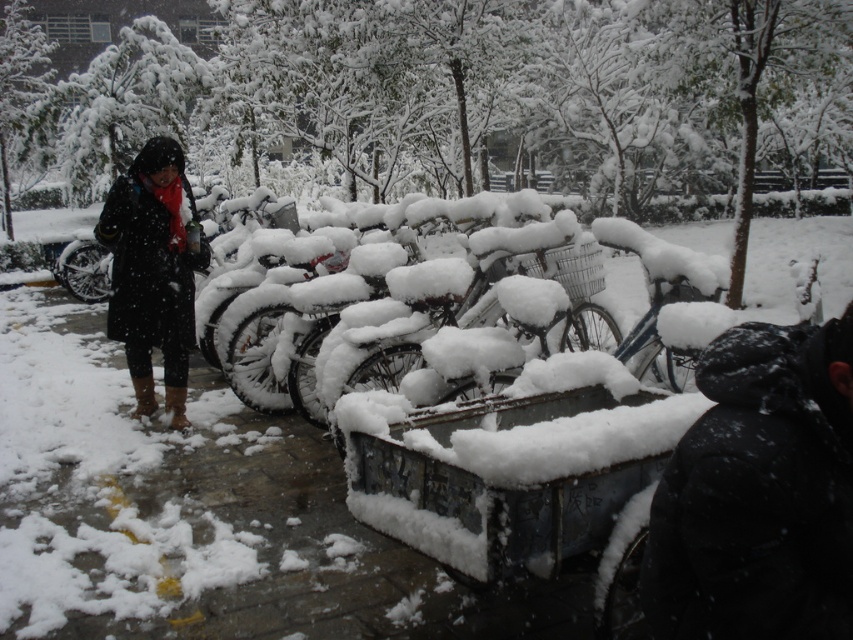
You are a pedestrian walking past the bicycles in the snowy scene. You notice two items of clothing nearby. Which item is shorter in height between the black fuzzy hat at upper right and the black matte coat at left?

The black fuzzy hat at upper right is shorter than the black matte coat at left.